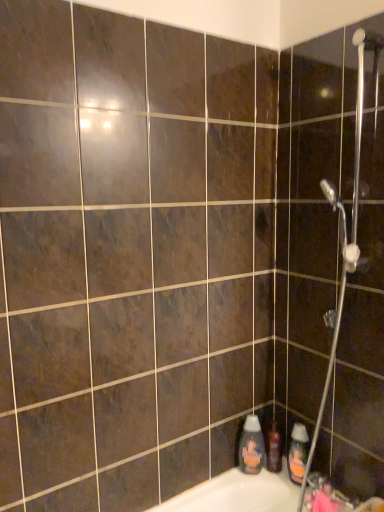
Question: Is the surface of metallic silver faucet at lower right in direct contact with orange matte bottle at lower right, the second cleaning product in the left-to-right sequence?

Choices:
 (A) yes
 (B) no

Answer: (A)

Question: Does metallic silver faucet at lower right contain orange matte bottle at lower right, placed as the first cleaning product when sorted from right to left?

Choices:
 (A) yes
 (B) no

Answer: (B)

Question: Does metallic silver faucet at lower right turn towards orange matte bottle at lower right, placed as the first cleaning product when sorted from right to left?

Choices:
 (A) no
 (B) yes

Answer: (A)

Question: Can you confirm if metallic silver faucet at lower right is wider than orange matte bottle at lower right, the second cleaning product in the left-to-right sequence?

Choices:
 (A) yes
 (B) no

Answer: (A)

Question: Can you confirm if metallic silver faucet at lower right is bigger than orange matte bottle at lower right, the second cleaning product in the left-to-right sequence?

Choices:
 (A) no
 (B) yes

Answer: (B)

Question: Considering the positions of translucent plastic shampoo bottle at lower right and metallic silver shower head at upper right in the image, is translucent plastic shampoo bottle at lower right wider or thinner than metallic silver shower head at upper right?

Choices:
 (A) thin
 (B) wide

Answer: (A)

Question: Considering the positions of translucent plastic shampoo bottle at lower right and metallic silver shower head at upper right in the image, is translucent plastic shampoo bottle at lower right taller or shorter than metallic silver shower head at upper right?

Choices:
 (A) short
 (B) tall

Answer: (A)

Question: Is translucent plastic shampoo bottle at lower right inside the boundaries of metallic silver shower head at upper right, or outside?

Choices:
 (A) outside
 (B) inside

Answer: (A)

Question: Considering the positions of translucent plastic shampoo bottle at lower right and metallic silver shower head at upper right in the image, is translucent plastic shampoo bottle at lower right bigger or smaller than metallic silver shower head at upper right?

Choices:
 (A) big
 (B) small

Answer: (B)

Question: From the image's perspective, is metallic silver faucet at lower right above or below translucent plastic bottle at lower right, the second cleaning product viewed from the right?

Choices:
 (A) below
 (B) above

Answer: (A)

Question: Considering the relative positions of metallic silver faucet at lower right and translucent plastic bottle at lower right, the second cleaning product viewed from the right, in the image provided, is metallic silver faucet at lower right to the left or to the right of translucent plastic bottle at lower right, the second cleaning product viewed from the right,?

Choices:
 (A) right
 (B) left

Answer: (A)

Question: From their relative heights in the image, would you say metallic silver faucet at lower right is taller or shorter than translucent plastic bottle at lower right, the second cleaning product viewed from the right?

Choices:
 (A) tall
 (B) short

Answer: (B)

Question: From a real-world perspective, relative to translucent plastic bottle at lower right, which is the 1th cleaning product in left-to-right order, is metallic silver faucet at lower right vertically above or below?

Choices:
 (A) above
 (B) below

Answer: (B)

Question: From a real-world perspective, relative to orange matte bottle at lower right, placed as the first cleaning product when sorted from right to left, is metallic silver faucet at lower right vertically above or below?

Choices:
 (A) above
 (B) below

Answer: (B)

Question: Based on their positions, is metallic silver faucet at lower right located to the left or right of orange matte bottle at lower right, the second cleaning product in the left-to-right sequence?

Choices:
 (A) right
 (B) left

Answer: (A)